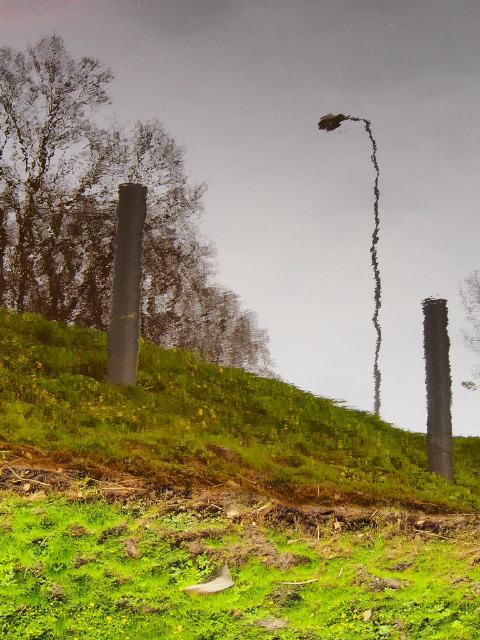
I want to click on green grassy hillside at center, so click(208, 422).

Is point (170, 435) more distant than point (119, 324)?

No, (170, 435) is in front of (119, 324).

What are the coordinates of `green grassy hillside at center` in the screenshot? It's located at (208, 422).

Does smooth black pole at left lie behind smooth black pole at center?

Yes, it is behind smooth black pole at center.

Between point (144, 227) and point (136, 317), which one is positioned in front?

Point (136, 317) is in front.

Does point (51, 241) lie in front of point (131, 348)?

No.

Locate an element on the screen. smooth black pole at left is located at coordinates (104, 212).

Between green mossy ground at lower center and smooth black pole at left, which one appears on the left side from the viewer's perspective?

From the viewer's perspective, smooth black pole at left appears more on the left side.

Between point (121, 529) and point (32, 112), which one is positioned behind?

Positioned behind is point (32, 112).

Identify the location of green mossy ground at lower center. (230, 572).